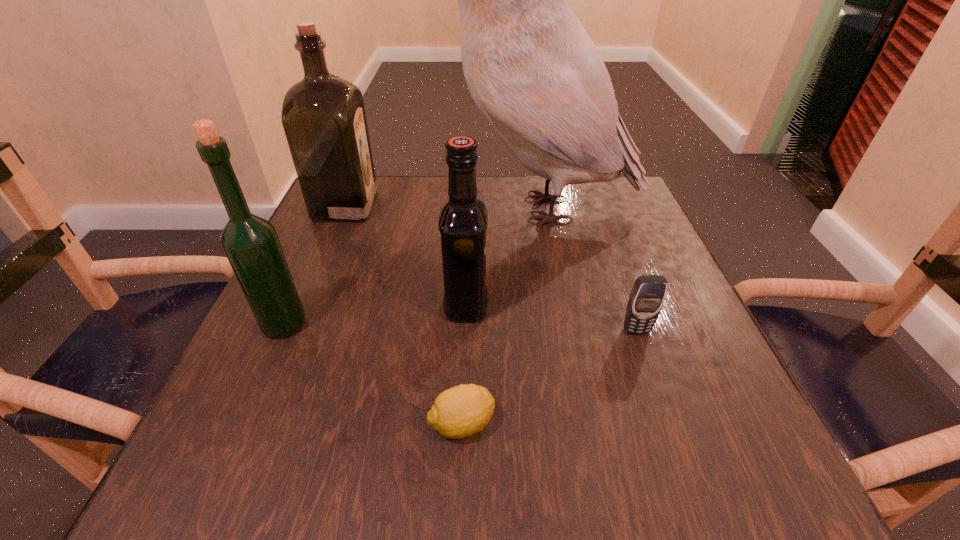
Locate an element on the screen. vacant space located 0.260m on the label of the farthest liquor is located at coordinates (482, 205).

Where is `vacant area located 0.200m on the front-facing side of the rightmost liquor`? Image resolution: width=960 pixels, height=540 pixels. vacant area located 0.200m on the front-facing side of the rightmost liquor is located at coordinates (596, 305).

The height and width of the screenshot is (540, 960). I want to click on free location located 0.270m on the front face of the fifth tallest object, so click(x=696, y=500).

Where is `vacant space located at the stem end of the shortest object`? This screenshot has width=960, height=540. vacant space located at the stem end of the shortest object is located at coordinates (607, 424).

Locate an element on the screen. This screenshot has width=960, height=540. parakeet present at the far edge is located at coordinates (536, 76).

Find the location of a particular element. Image resolution: width=960 pixels, height=540 pixels. liquor that is at the far edge is located at coordinates (323, 116).

You are a GUI agent. You are given a task and a screenshot of the screen. Output one action in this format:
    pyautogui.click(x=<x>, y=<y>)
    Task: Click on the object that is at the near edge
    Image resolution: width=960 pixels, height=540 pixels.
    Given the screenshot: What is the action you would take?
    pyautogui.click(x=462, y=410)

Where is `parakeet situated at the right edge`? This screenshot has height=540, width=960. parakeet situated at the right edge is located at coordinates (536, 76).

The height and width of the screenshot is (540, 960). In order to click on cellular telephone present at the right edge in this screenshot , I will do `click(646, 299)`.

Find the location of a particular element. The image size is (960, 540). object at the far left corner is located at coordinates (323, 116).